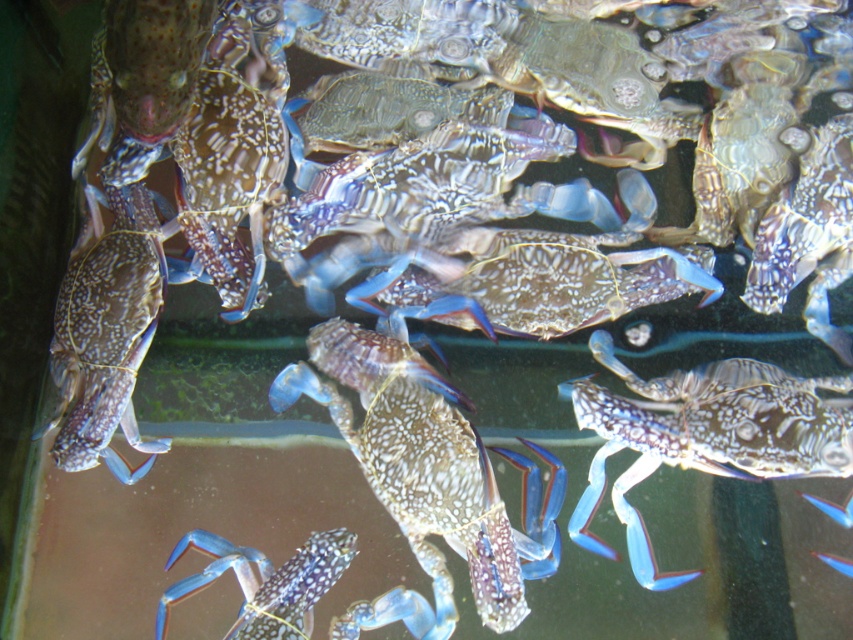
Question: Which of the following is the closest to the observer?

Choices:
 (A) blue speckled crab at center
 (B) shiny blue crab at bottom left
 (C) speckled shell crab at center

Answer: (B)

Question: Which object is farther from the camera taking this photo?

Choices:
 (A) blue speckled crab at center
 (B) speckled shell crab at center

Answer: (A)

Question: From the image, what is the correct spatial relationship of blue speckled crab at center in relation to speckled blue crab at left?

Choices:
 (A) right
 (B) left

Answer: (A)

Question: Does speckled shell crab at center appear under shiny blue crab at bottom left?

Choices:
 (A) yes
 (B) no

Answer: (B)

Question: Which point is farther from the camera taking this photo?

Choices:
 (A) (115, 266)
 (B) (579, 378)
 (C) (253, 560)

Answer: (B)

Question: Is speckled shell crab at center positioned behind shiny blue crab at bottom left?

Choices:
 (A) no
 (B) yes

Answer: (B)